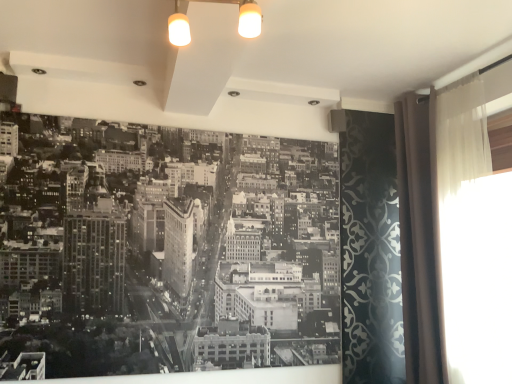
Question: Can you confirm if black paper at center is smaller than beige fabric curtain at right?

Choices:
 (A) yes
 (B) no

Answer: (B)

Question: Would you say black paper at center contains beige fabric curtain at right?

Choices:
 (A) yes
 (B) no

Answer: (B)

Question: From the image's perspective, would you say black paper at center is positioned over beige fabric curtain at right?

Choices:
 (A) no
 (B) yes

Answer: (A)

Question: Is black paper at center completely or partially outside of beige fabric curtain at right?

Choices:
 (A) yes
 (B) no

Answer: (A)

Question: Does black paper at center have a greater height compared to beige fabric curtain at right?

Choices:
 (A) yes
 (B) no

Answer: (B)

Question: Is beige fabric curtain at right inside or outside of translucent fabric curtain at right?

Choices:
 (A) outside
 (B) inside

Answer: (A)

Question: From a real-world perspective, is beige fabric curtain at right positioned above or below translucent fabric curtain at right?

Choices:
 (A) below
 (B) above

Answer: (A)

Question: Would you say beige fabric curtain at right is to the left or to the right of translucent fabric curtain at right in the picture?

Choices:
 (A) right
 (B) left

Answer: (B)

Question: In terms of width, does beige fabric curtain at right look wider or thinner when compared to translucent fabric curtain at right?

Choices:
 (A) wide
 (B) thin

Answer: (A)

Question: Considering the positions of translucent fabric curtain at right and beige fabric curtain at right in the image, is translucent fabric curtain at right bigger or smaller than beige fabric curtain at right?

Choices:
 (A) small
 (B) big

Answer: (A)

Question: Does point (453, 278) appear closer or farther from the camera than point (431, 160)?

Choices:
 (A) farther
 (B) closer

Answer: (B)

Question: Is translucent fabric curtain at right inside the boundaries of beige fabric curtain at right, or outside?

Choices:
 (A) inside
 (B) outside

Answer: (B)

Question: In the image, is translucent fabric curtain at right positioned in front of or behind beige fabric curtain at right?

Choices:
 (A) front
 (B) behind

Answer: (A)

Question: Considering the positions of black paper at center and translucent fabric curtain at right in the image, is black paper at center wider or thinner than translucent fabric curtain at right?

Choices:
 (A) thin
 (B) wide

Answer: (A)

Question: Considering their positions, is black paper at center located in front of or behind translucent fabric curtain at right?

Choices:
 (A) behind
 (B) front

Answer: (A)